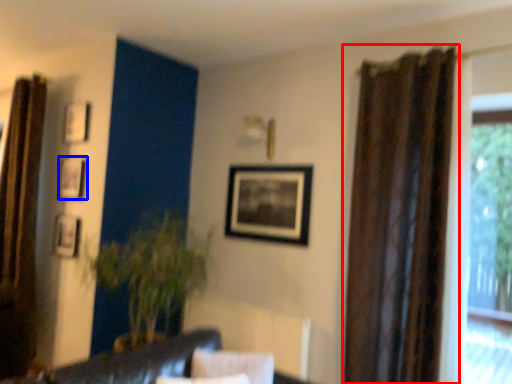
Question: Among these objects, which one is nearest to the camera, curtain (highlighted by a red box) or picture frame (highlighted by a blue box)?

Choices:
 (A) curtain
 (B) picture frame

Answer: (A)